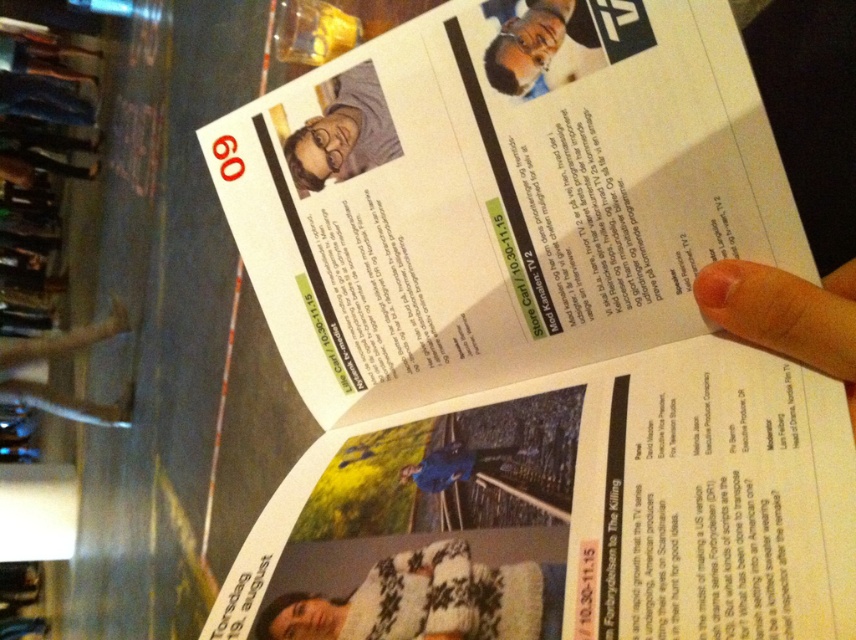
Question: Is flesh-toned skin at upper right positioned in front of matte gray shirt at upper center?

Choices:
 (A) no
 (B) yes

Answer: (B)

Question: Which point is closer to the camera?

Choices:
 (A) white knitted sweater at lower center
 (B) flesh-toned skin at upper right
 (C) matte gray shirt at upper center

Answer: (B)

Question: Where is white knitted sweater at lower center located in relation to flesh-toned skin at upper right in the image?

Choices:
 (A) below
 (B) above

Answer: (A)

Question: Can you confirm if white knitted sweater at lower center is positioned below flesh-toned skin at upper right?

Choices:
 (A) no
 (B) yes

Answer: (B)

Question: Which of these objects is positioned farthest from the matte gray shirt at upper center?

Choices:
 (A) white knitted sweater at lower center
 (B) matte black face at upper center

Answer: (A)

Question: Based on their relative distances, which object is farther from the matte black face at upper center?

Choices:
 (A) flesh-toned skin at upper right
 (B) white knitted sweater at lower center

Answer: (B)